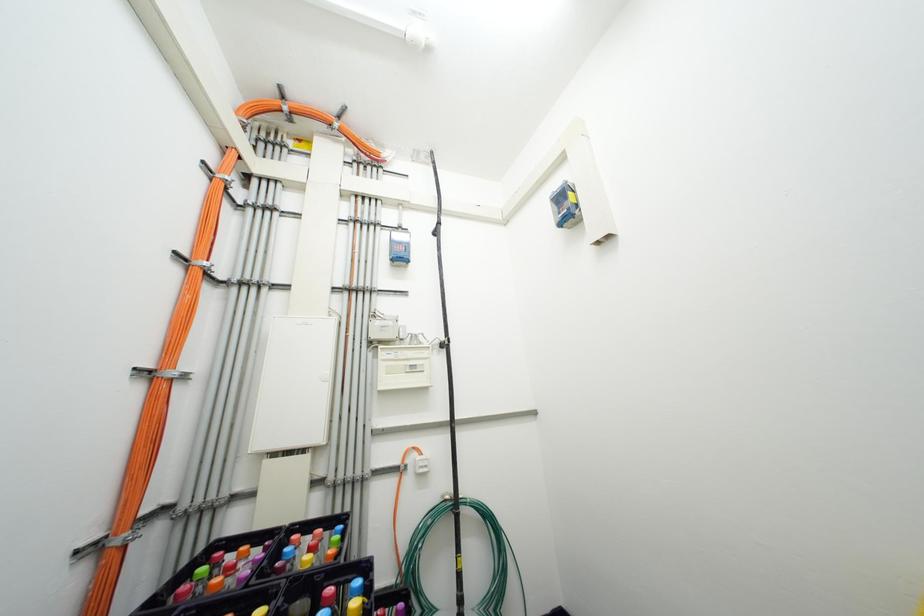
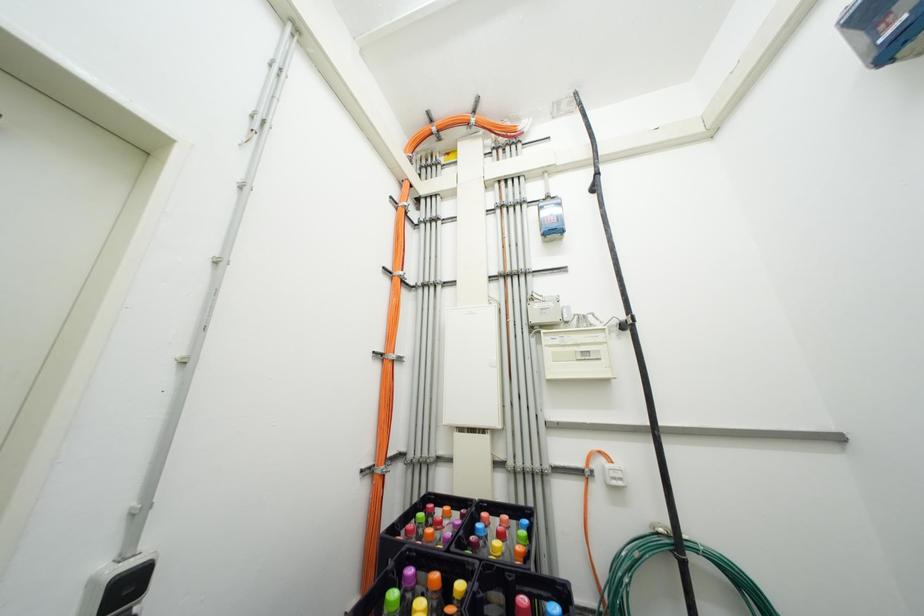
Question: The camera is either moving clockwise (left) or counter-clockwise (right) around the object. The first image is from the beginning of the video and the second image is from the end. Is the camera moving left or right when shooting the video?

Choices:
 (A) Left
 (B) Right

Answer: (B)